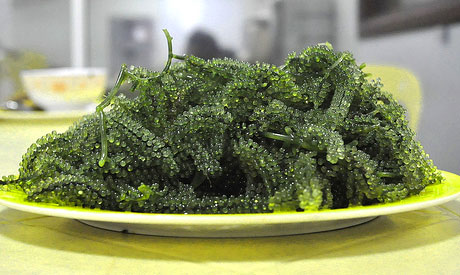
You are a GUI agent. You are given a task and a screenshot of the screen. Output one action in this format:
    pyautogui.click(x=<x>, y=<y>)
    Task: Click on the green plastic plants
    
    Given the screenshot: What is the action you would take?
    pyautogui.click(x=196, y=121)